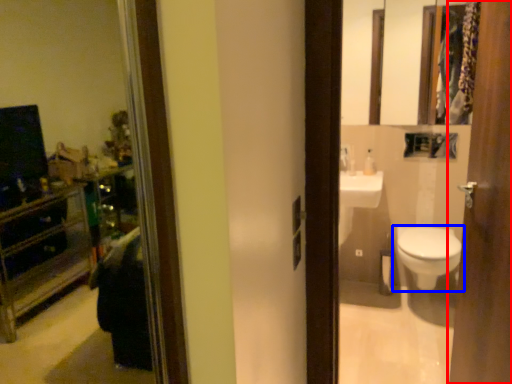
Question: Among these objects, which one is farthest to the camera, door (highlighted by a red box) or toilet (highlighted by a blue box)?

Choices:
 (A) door
 (B) toilet

Answer: (B)